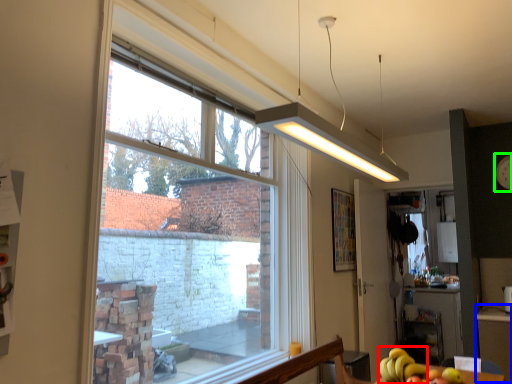
Question: Estimate the real-world distances between objects in this image. Which object is closer to banana (highlighted by a red box), table (highlighted by a blue box) or clock (highlighted by a green box)?

Choices:
 (A) table
 (B) clock

Answer: (A)